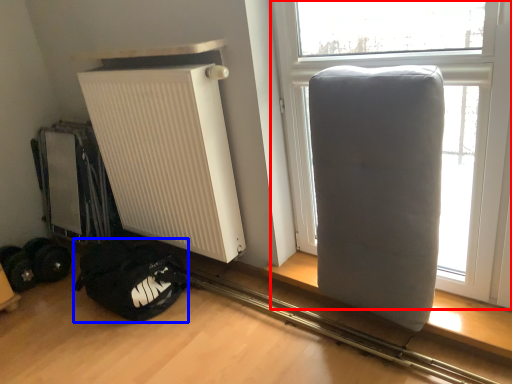
Question: Which object appears farthest to the camera in this image, window (highlighted by a red box) or sleeping bag (highlighted by a blue box)?

Choices:
 (A) window
 (B) sleeping bag

Answer: (B)